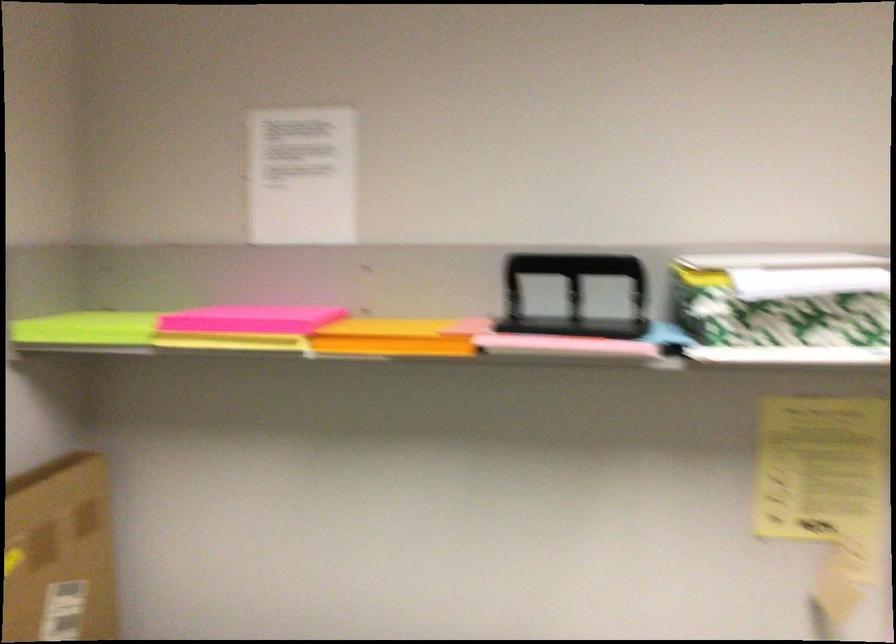
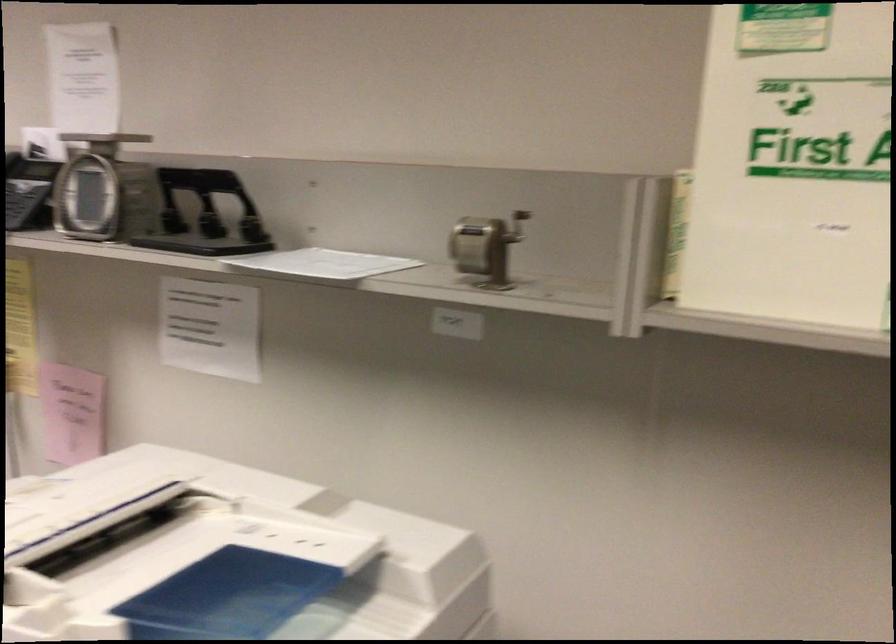
Question: Which direction would the cameraman need to move to produce the second image? Reply with the corresponding letter.

Choices:
 (A) Left
 (B) Right
 (C) Forward
 (D) Backward

Answer: (D)